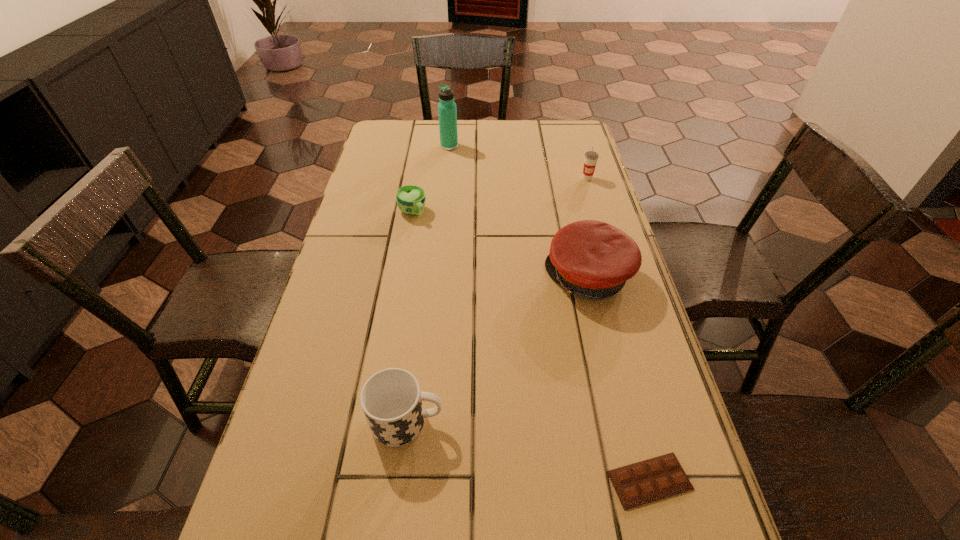
Identify the location of cap located at the right edge. (593, 259).

Locate an element on the screen. This screenshot has width=960, height=540. chocolate bar that is at the right edge is located at coordinates (640, 483).

Where is `free space at the far edge`? The height and width of the screenshot is (540, 960). free space at the far edge is located at coordinates (480, 131).

Where is `blank space at the left edge`? blank space at the left edge is located at coordinates (398, 186).

In the image, there is a desktop. What are the coordinates of `blank space at the right edge` in the screenshot? It's located at (568, 176).

Locate an element on the screen. The width and height of the screenshot is (960, 540). empty space that is in between the second nearest object and the second farthest cup is located at coordinates (410, 316).

The image size is (960, 540). In order to click on free space that is in between the nearest cup and the rightmost cup in this screenshot , I will do `click(497, 300)`.

Locate an element on the screen. vacant area between the farthest cup and the chocolate bar is located at coordinates (618, 329).

The image size is (960, 540). What are the coordinates of `vacant space that is in between the nearest cup and the shortest object` in the screenshot? It's located at (529, 451).

At what (x,y) coordinates should I click in order to perform the action: click on free space between the thermos bottle and the shortest cup. Please return your answer as a coordinate pair (x, y). Looking at the image, I should click on (431, 179).